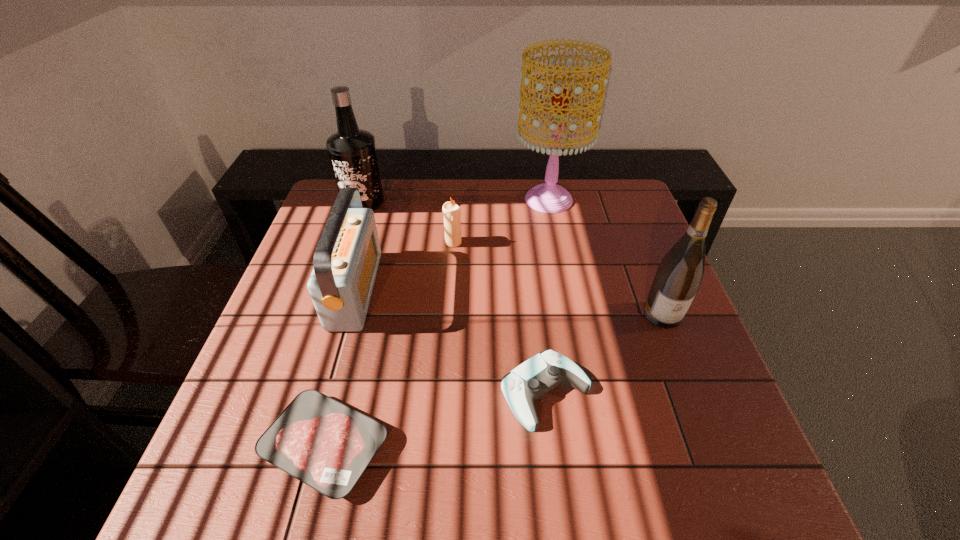
Where is `steak that is at the left edge`? Image resolution: width=960 pixels, height=540 pixels. steak that is at the left edge is located at coordinates (327, 445).

Locate an element on the screen. The width and height of the screenshot is (960, 540). lampshade at the right edge is located at coordinates tap(549, 197).

Where is `wine bottle at the right edge`? This screenshot has height=540, width=960. wine bottle at the right edge is located at coordinates (679, 275).

Locate an element on the screen. This screenshot has height=540, width=960. object at the far left corner is located at coordinates (352, 151).

At what (x,y) coordinates should I click in order to perform the action: click on object present at the near left corner. Please return your answer as a coordinate pair (x, y). The width and height of the screenshot is (960, 540). Looking at the image, I should click on [327, 445].

Where is `object that is at the far right corner`? The height and width of the screenshot is (540, 960). object that is at the far right corner is located at coordinates (549, 197).

You are a GUI agent. You are given a task and a screenshot of the screen. Output one action in this format:
    pyautogui.click(x=<x>, y=<y>)
    Task: Click on the vacant region at the far edge of the desktop
    The height and width of the screenshot is (540, 960).
    Given the screenshot: What is the action you would take?
    pyautogui.click(x=446, y=189)

Locate an element on the screen. vacant space at the near edge is located at coordinates click(x=540, y=498).

In the image, there is a desktop. Where is `vacant space at the left edge`? This screenshot has height=540, width=960. vacant space at the left edge is located at coordinates (283, 319).

Locate an element on the screen. This screenshot has height=540, width=960. vacant area at the right edge of the desktop is located at coordinates (610, 250).